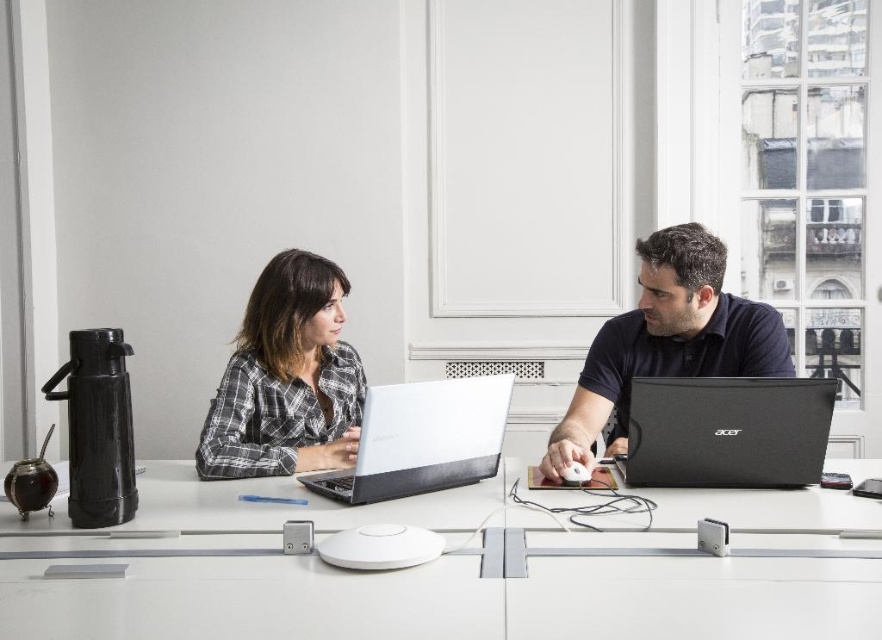
Describe the element at coordinates (286, 378) in the screenshot. I see `plaid fabric shirt at center` at that location.

Does plaid fabric shirt at center appear on the left side of matte silver laptop at center?

Yes, plaid fabric shirt at center is to the left of matte silver laptop at center.

The width and height of the screenshot is (882, 640). I want to click on plaid fabric shirt at center, so click(x=286, y=378).

Does white glossy table at center appear on the right side of matte silver laptop at center?

Incorrect, white glossy table at center is not on the right side of matte silver laptop at center.

Looking at this image, between white glossy table at center and matte silver laptop at center, which one is positioned lower?

white glossy table at center is below.

At what (x,y) coordinates should I click in order to perform the action: click on white glossy table at center. Please return your answer as a coordinate pair (x, y). The height and width of the screenshot is (640, 882). Looking at the image, I should click on (454, 572).

How much distance is there between black matte laptop at center and white matte laptop at center?

black matte laptop at center is 18.23 inches away from white matte laptop at center.

Based on the photo, is black matte laptop at center smaller than white matte laptop at center?

Correct, black matte laptop at center occupies less space than white matte laptop at center.

At what (x,y) coordinates should I click in order to perform the action: click on black matte laptop at center. Please return your answer as a coordinate pair (x, y). Looking at the image, I should click on (727, 432).